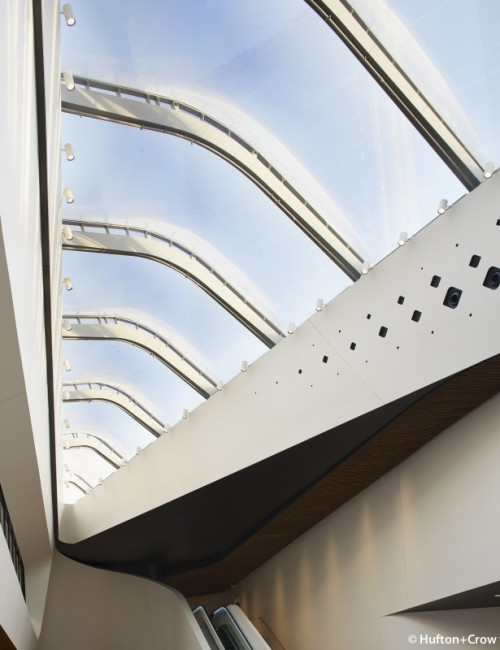
Locate an element on the screen. shadows on wall is located at coordinates (392, 495), (341, 520), (312, 543), (295, 556), (274, 566).